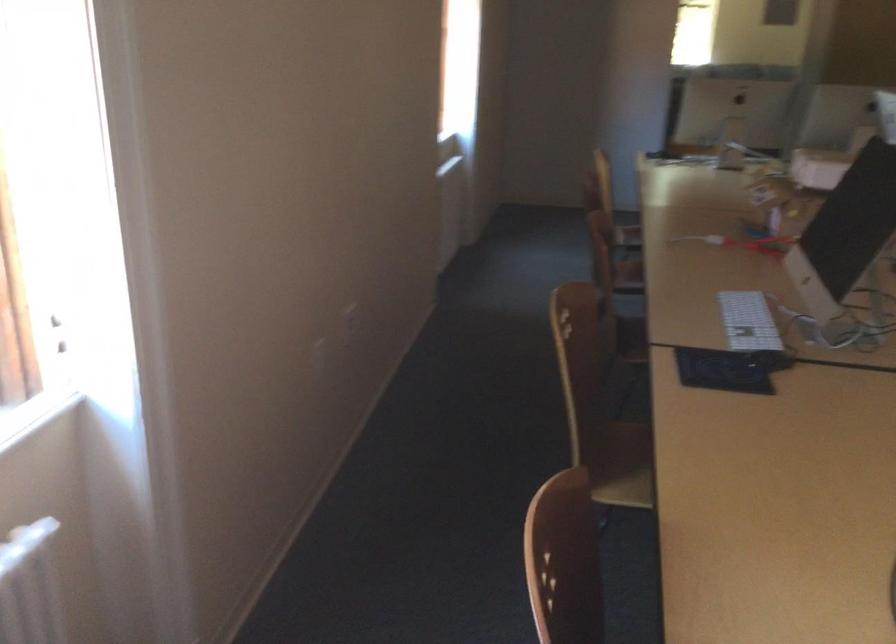
Find the location of a particular element. black trackpad is located at coordinates (720, 371).